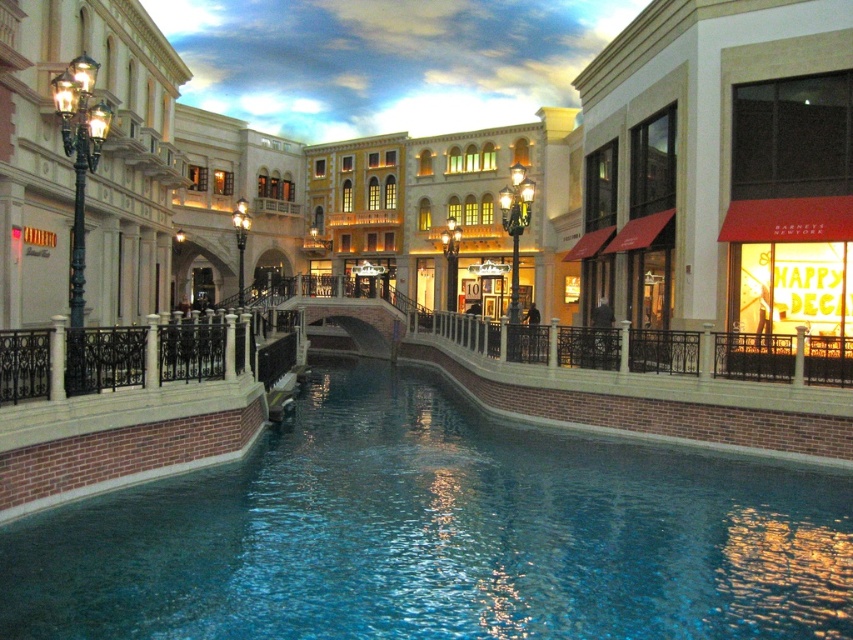
Looking at this image, you are a tour guide leading a group along the canal. You want to point out the distance between the two landmarks. How far apart are the matte red awning at right and the matte black lamppost at left?

The matte red awning at right is 21.96 meters away from the matte black lamppost at left.

You are standing on the edge of the canal in the Venetian shopping mall. You see the blue smooth water at center and the matte red awning at right. Which object is closer to you?

The blue smooth water at center is closer to you because it is in front of the matte red awning at right.

You are standing on the ornate railing next to the matte black lamppost at left and want to jump into the blue smooth water at center. Is the water directly below you?

The blue smooth water at center is located below the matte black lamppost at left, so yes, the water is directly below you.